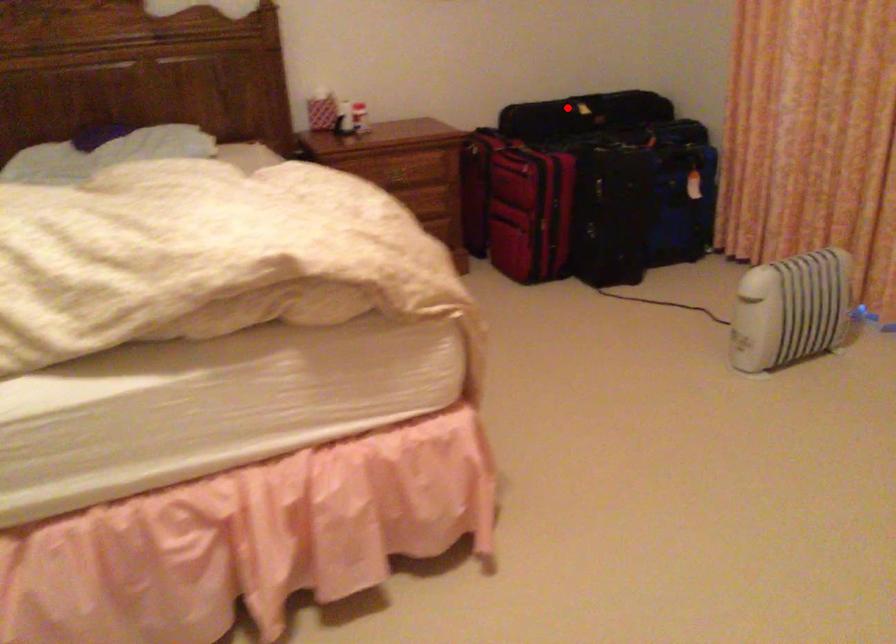
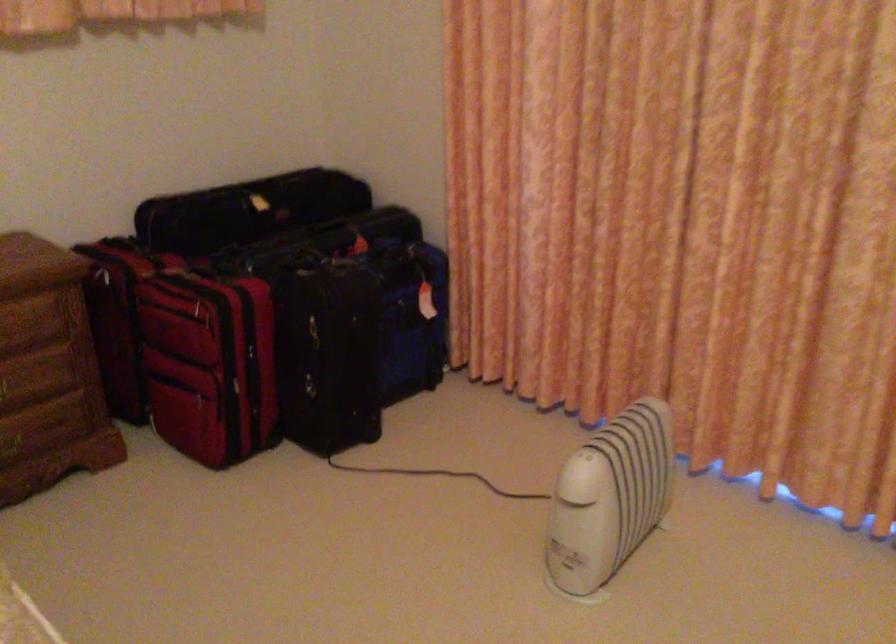
Question: A red point is marked in image1. In image2, is the corresponding 3D point closer to the camera or farther? Reply with the corresponding letter.

Choices:
 (A) The corresponding 3D point is closer.
 (B) The corresponding 3D point is farther.

Answer: (A)